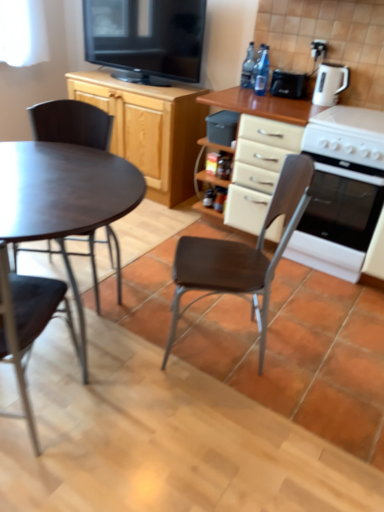
Question: Can you confirm if brown leather chair at center, the third chair viewed from the left, is wider than wooden cabinet at upper left?

Choices:
 (A) yes
 (B) no

Answer: (B)

Question: Is brown leather chair at center, the third chair viewed from the left, surrounding wooden cabinet at upper left?

Choices:
 (A) no
 (B) yes

Answer: (A)

Question: Is brown leather chair at center, which appears as the 1th chair when viewed from the right, shorter than wooden cabinet at upper left?

Choices:
 (A) yes
 (B) no

Answer: (B)

Question: Is brown leather chair at center, the third chair viewed from the left, positioned in front of wooden cabinet at upper left?

Choices:
 (A) no
 (B) yes

Answer: (B)

Question: From a real-world perspective, is brown leather chair at center, the third chair viewed from the left, physically above wooden cabinet at upper left?

Choices:
 (A) yes
 (B) no

Answer: (A)

Question: Is brown leather chair at center, the third chair viewed from the left, facing towards wooden cabinet at upper left?

Choices:
 (A) yes
 (B) no

Answer: (B)

Question: From a real-world perspective, is black glossy television at upper center located beneath wooden cabinet at upper left?

Choices:
 (A) yes
 (B) no

Answer: (B)

Question: Does black glossy television at upper center have a greater width compared to wooden cabinet at upper left?

Choices:
 (A) yes
 (B) no

Answer: (B)

Question: Can you confirm if black glossy television at upper center is bigger than wooden cabinet at upper left?

Choices:
 (A) no
 (B) yes

Answer: (A)

Question: Is black glossy television at upper center positioned behind wooden cabinet at upper left?

Choices:
 (A) no
 (B) yes

Answer: (A)

Question: Considering the relative sizes of black glossy television at upper center and wooden cabinet at upper left in the image provided, is black glossy television at upper center smaller than wooden cabinet at upper left?

Choices:
 (A) no
 (B) yes

Answer: (B)

Question: Is wooden cabinet at upper left inside black glossy television at upper center?

Choices:
 (A) no
 (B) yes

Answer: (A)

Question: Can you confirm if wooden cabinet at upper left is shorter than black plastic container at center, placed as the 1th appliance when sorted from bottom to top?

Choices:
 (A) no
 (B) yes

Answer: (A)